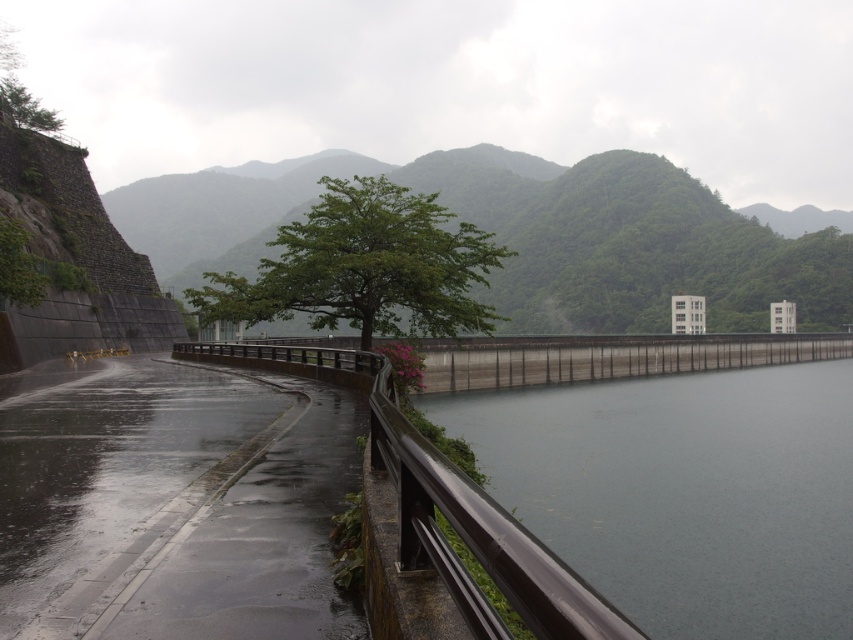
Question: Is green leafy tree at center to the left of smooth metal railing at center from the viewer's perspective?

Choices:
 (A) yes
 (B) no

Answer: (A)

Question: Among these objects, which one is farthest from the camera?

Choices:
 (A) gray concrete dam at center
 (B) smooth metal railing at center

Answer: (A)

Question: Is green leafy tree at center below smooth metal railing at center?

Choices:
 (A) yes
 (B) no

Answer: (B)

Question: Which object is positioned farthest from the smooth metal railing at center?

Choices:
 (A) green leafy mountain at center
 (B) green leafy tree at center

Answer: (A)

Question: Among these objects, which one is farthest from the camera?

Choices:
 (A) green leafy tree at center
 (B) smooth metal railing at center
 (C) gray concrete dam at center
 (D) green leafy mountain at center

Answer: (D)

Question: Is gray concrete dam at center thinner than green leafy mountain at center?

Choices:
 (A) yes
 (B) no

Answer: (A)